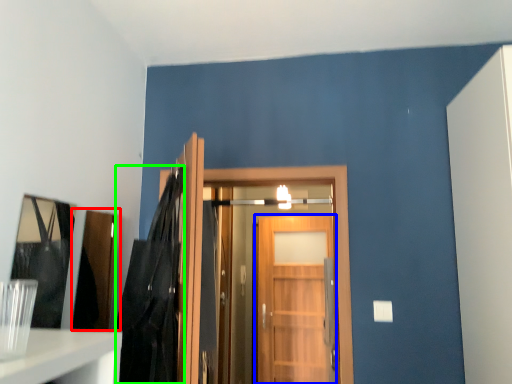
Question: Which object is positioned closest to cabinetry (highlighted by a red box)? Select from door (highlighted by a blue box) and dark (highlighted by a green box).

Choices:
 (A) door
 (B) dark

Answer: (B)